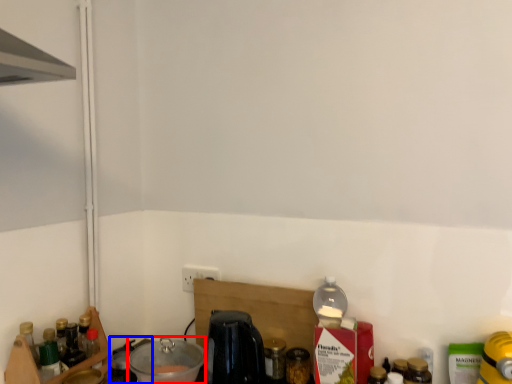
Question: Among these objects, which one is farthest to the camera, appliance (highlighted by a red box) or appliance (highlighted by a blue box)?

Choices:
 (A) appliance
 (B) appliance

Answer: (B)